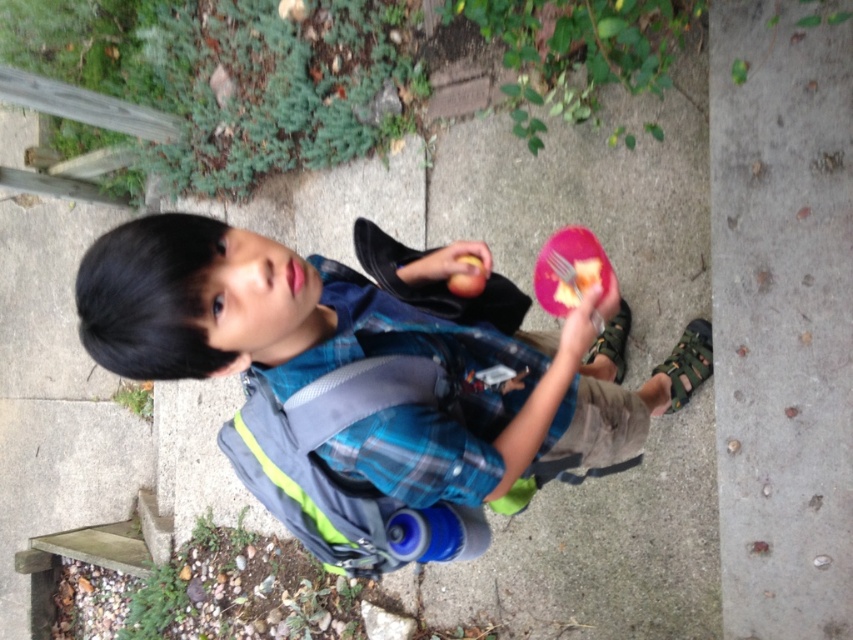
Question: Can you confirm if gray concrete at lower right is positioned to the right of pink plastic fork at upper center?

Choices:
 (A) yes
 (B) no

Answer: (A)

Question: Which of the following is the farthest from the observer?

Choices:
 (A) gray concrete at lower right
 (B) pink plastic fork at upper center
 (C) blue plaid shirt at center

Answer: (A)

Question: Is gray concrete at lower right to the right of pink plastic fork at upper center from the viewer's perspective?

Choices:
 (A) yes
 (B) no

Answer: (A)

Question: Which of the following is the closest to the observer?

Choices:
 (A) gray concrete at lower right
 (B) pink plastic fork at upper center

Answer: (B)

Question: Is gray concrete at lower right thinner than pink plastic fork at upper center?

Choices:
 (A) yes
 (B) no

Answer: (B)

Question: Which point is closer to the camera taking this photo?

Choices:
 (A) (724, 464)
 (B) (544, 244)

Answer: (A)